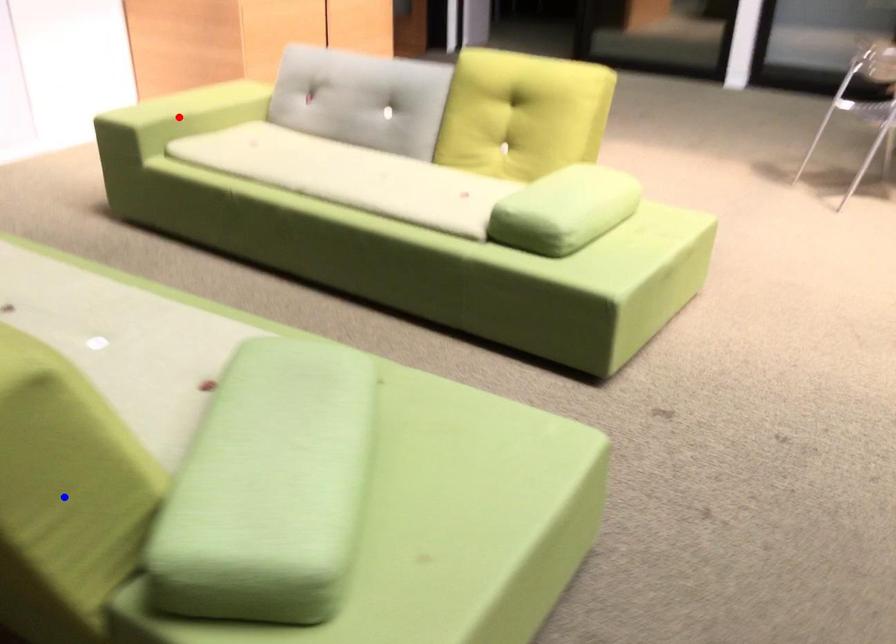
Question: In the image, two points are highlighted. Which point is nearer to the camera? Reply with the corresponding letter.

Choices:
 (A) blue point
 (B) red point

Answer: (A)